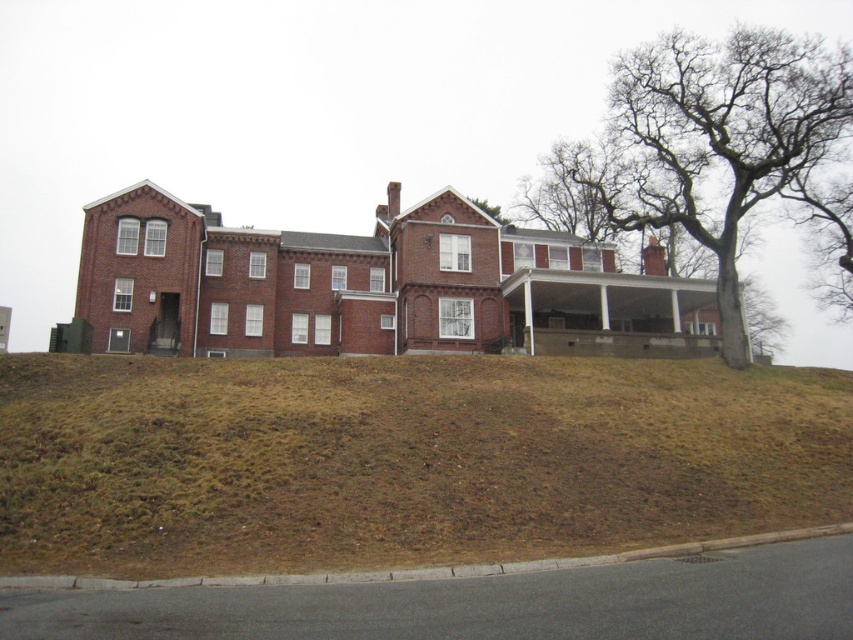
You are standing on the porch of the two story brick building and looking out. You notice brown grass at lower center and bare branches at upper right. Which object is taller from your viewpoint?

The brown grass at lower center has a lesser height compared to bare branches at upper right, so the bare branches at upper right are taller from your viewpoint.

Looking at this image, you are standing at the top of the hill where the two story brick building is located. You want to walk down to the brown grass at lower center which is at point (402, 460). Is the path to the grass going uphill or downhill?

The brown grass at lower center is located at point (402, 460), which is downhill from your current position at the top of the hill. Therefore, the path to the grass would be going downhill.

You are standing in front of the two story brick building on the hill. You see brown grass at lower center and bare branches at upper right. Which of these two objects is wider?

The brown grass at lower center is narrower than the bare branches at upper right, so the bare branches at upper right are wider.